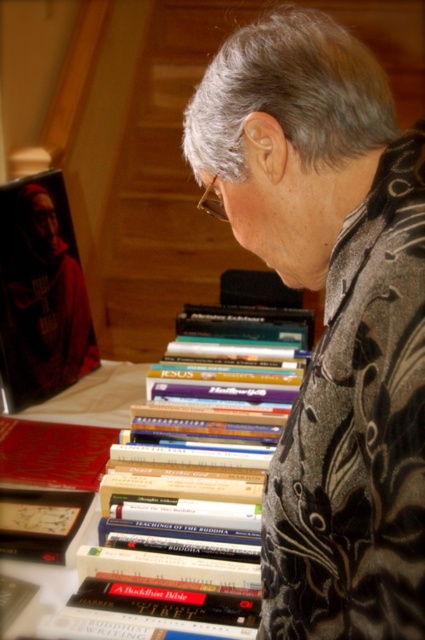
Based on the photo, which is below, hardcover book at center or matte black book at left?

Positioned lower is hardcover book at center.

Is hardcover book at center further to the viewer compared to matte black book at left?

No, it is not.

Who is more distant from viewer, (207, 461) or (0, 224)?

The point (0, 224) is more distant.

This screenshot has width=425, height=640. I want to click on hardcover book at center, so click(x=193, y=486).

Can you confirm if black textured jacket at center is shorter than clear plastic glasses at upper center?

In fact, black textured jacket at center may be taller than clear plastic glasses at upper center.

Is black textured jacket at center taller than clear plastic glasses at upper center?

Yes, black textured jacket at center is taller than clear plastic glasses at upper center.

Find the location of a particular element. This screenshot has height=640, width=425. black textured jacket at center is located at coordinates (331, 316).

You are a GUI agent. You are given a task and a screenshot of the screen. Output one action in this format:
    pyautogui.click(x=<x>, y=<y>)
    Task: Click on the black textured jacket at center
    The image size is (425, 640).
    Given the screenshot: What is the action you would take?
    pyautogui.click(x=331, y=316)

Does point (334, 52) come behind point (183, 589)?

No, it is in front of (183, 589).

This screenshot has height=640, width=425. I want to click on black textured jacket at center, so click(331, 316).